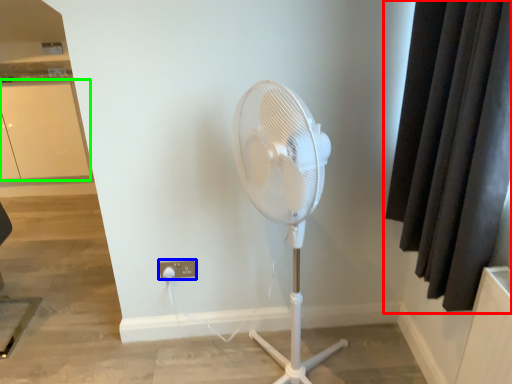
Question: Based on their relative distances, which object is farther from curtain (highlighted by a red box)? Choose from electric outlet (highlighted by a blue box) and screen door (highlighted by a green box).

Choices:
 (A) electric outlet
 (B) screen door

Answer: (B)